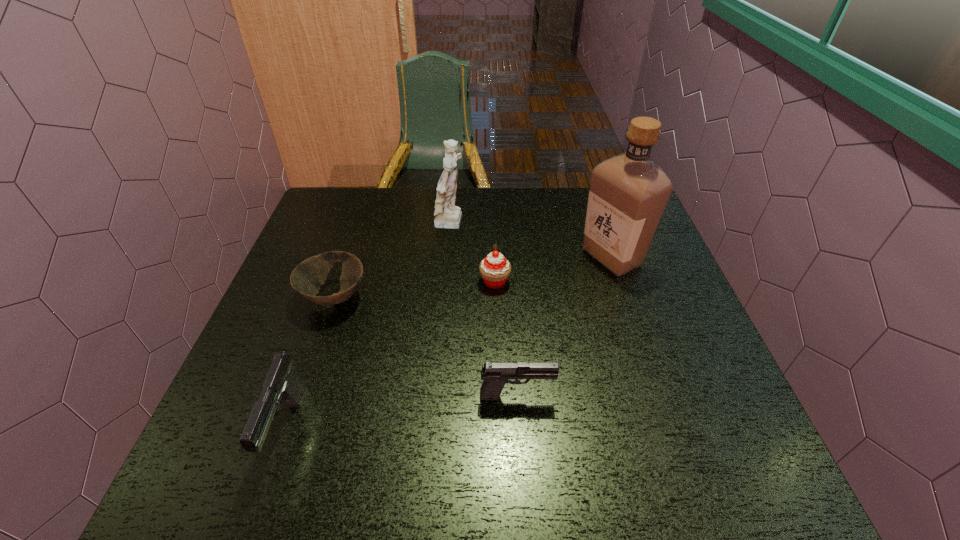
I want to click on vacant space in between the shorter pistol and the left pistol, so click(x=402, y=411).

This screenshot has width=960, height=540. What are the coordinates of `empty space that is in between the taller pistol and the shortest object` in the screenshot? It's located at (311, 362).

You are a GUI agent. You are given a task and a screenshot of the screen. Output one action in this format:
    pyautogui.click(x=<x>, y=<y>)
    Task: Click on the vacant point located between the fourth shortest object and the tallest object
    
    Given the screenshot: What is the action you would take?
    pyautogui.click(x=449, y=342)

Locate an element on the screen. empty space that is in between the shorter pistol and the cupcake is located at coordinates (506, 338).

You are a GUI agent. You are given a task and a screenshot of the screen. Output one action in this format:
    pyautogui.click(x=<x>, y=<y>)
    Task: Click on the vacant region between the bowl and the fifth shortest object
    This screenshot has width=960, height=540.
    Given the screenshot: What is the action you would take?
    pyautogui.click(x=394, y=261)

This screenshot has width=960, height=540. I want to click on empty space that is in between the left pistol and the bowl, so point(311,362).

Where is `empty location between the rightmost object and the shortest object`? This screenshot has height=540, width=960. empty location between the rightmost object and the shortest object is located at coordinates (473, 277).

Where is `the second closest object to the figurine`? This screenshot has width=960, height=540. the second closest object to the figurine is located at coordinates (306, 279).

Point out which object is positioned as the second nearest to the shorter pistol. Please provide its 2D coordinates. Your answer should be formatted as a tuple, i.e. [(x, y)], where the tuple contains the x and y coordinates of a point satisfying the conditions above.

[(306, 279)]

This screenshot has height=540, width=960. Find the location of `vacant space that satisfies the following two spatial constraints: 1. on the front-facing side of the rightmost object; 2. aim along the barrel of the left pistol`. vacant space that satisfies the following two spatial constraints: 1. on the front-facing side of the rightmost object; 2. aim along the barrel of the left pistol is located at coordinates (669, 428).